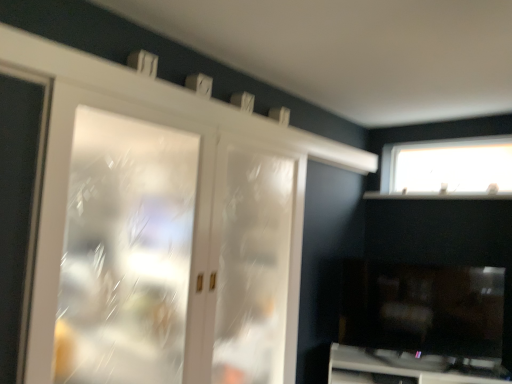
Question: Does clear glass door at center, placed as the second screen door when sorted from front to back, have a lesser height compared to white frosted glass screen door at left, the 1th screen door from the front?

Choices:
 (A) no
 (B) yes

Answer: (A)

Question: Is clear glass door at center, positioned as the 1th screen door in back-to-front order, next to white frosted glass screen door at left, the second screen door positioned from the right?

Choices:
 (A) no
 (B) yes

Answer: (A)

Question: Can you confirm if clear glass door at center, the first screen door in the right-to-left sequence, is thinner than white frosted glass screen door at left, the second screen door positioned from the right?

Choices:
 (A) yes
 (B) no

Answer: (A)

Question: From the image's perspective, would you say clear glass door at center, the 2th screen door in the left-to-right sequence, is shown under white frosted glass screen door at left, the second screen door positioned from the right?

Choices:
 (A) yes
 (B) no

Answer: (A)

Question: Could you tell me if clear glass door at center, the first screen door in the right-to-left sequence, is facing white frosted glass screen door at left, the second screen door positioned from the back?

Choices:
 (A) no
 (B) yes

Answer: (A)

Question: Is transparent glass window at upper right taller or shorter than clear glass door at center, the first screen door in the right-to-left sequence?

Choices:
 (A) short
 (B) tall

Answer: (A)

Question: From the image's perspective, is transparent glass window at upper right positioned above or below clear glass door at center, positioned as the 1th screen door in back-to-front order?

Choices:
 (A) below
 (B) above

Answer: (B)

Question: Looking at their shapes, would you say transparent glass window at upper right is wider or thinner than clear glass door at center, the 2th screen door in the left-to-right sequence?

Choices:
 (A) thin
 (B) wide

Answer: (A)

Question: Is transparent glass window at upper right bigger or smaller than clear glass door at center, the first screen door in the right-to-left sequence?

Choices:
 (A) big
 (B) small

Answer: (B)

Question: In the image, is transparent glass window at upper right on the left side or the right side of white frosted glass screen door at left, the second screen door positioned from the back?

Choices:
 (A) right
 (B) left

Answer: (A)

Question: From the image's perspective, relative to white frosted glass screen door at left, the second screen door positioned from the back, is transparent glass window at upper right above or below?

Choices:
 (A) below
 (B) above

Answer: (B)

Question: Is transparent glass window at upper right wider or thinner than white frosted glass screen door at left, the second screen door positioned from the right?

Choices:
 (A) wide
 (B) thin

Answer: (B)

Question: Do you think transparent glass window at upper right is within white frosted glass screen door at left, the 1th screen door from the front, or outside of it?

Choices:
 (A) outside
 (B) inside

Answer: (A)

Question: Is white frosted glass screen door at left, the second screen door positioned from the back, bigger or smaller than white glossy cabinet at lower right?

Choices:
 (A) big
 (B) small

Answer: (B)

Question: Is white frosted glass screen door at left, the second screen door positioned from the right, spatially inside white glossy cabinet at lower right, or outside of it?

Choices:
 (A) inside
 (B) outside

Answer: (B)